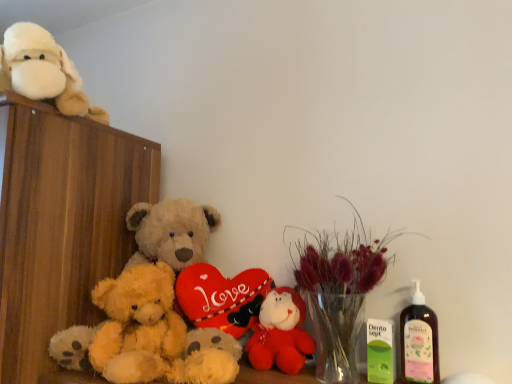
Question: Is velvet red plush toy at center situated inside white plush toy at upper left, marked as the 3th teddy bear in a bottom-to-top arrangement, or outside?

Choices:
 (A) outside
 (B) inside

Answer: (A)

Question: From the image's perspective, is velvet red plush toy at center positioned above or below white plush toy at upper left, marked as the 1th teddy bear in a top-to-bottom arrangement?

Choices:
 (A) above
 (B) below

Answer: (B)

Question: Which is nearer to the fluffy yellow teddy bear at center, which is the 3th teddy bear in top-to-bottom order?

Choices:
 (A) wooden cabinet at left
 (B) pink plastic bottle at right
 (C) white plush toy at upper left, marked as the 1th teddy bear in a top-to-bottom arrangement
 (D) translucent glass vase at center
 (E) velvet red plush toy at center

Answer: (A)

Question: Which object is the closest to the white plush toy at upper left, marked as the 1th teddy bear in a top-to-bottom arrangement?

Choices:
 (A) velvet red plush toy at center
 (B) translucent glass vase at center
 (C) fluffy beige teddy bear at center, which appears as the 2th teddy bear when viewed from the top
 (D) fluffy yellow teddy bear at center, the 1th teddy bear positioned from the bottom
 (E) wooden cabinet at left

Answer: (E)